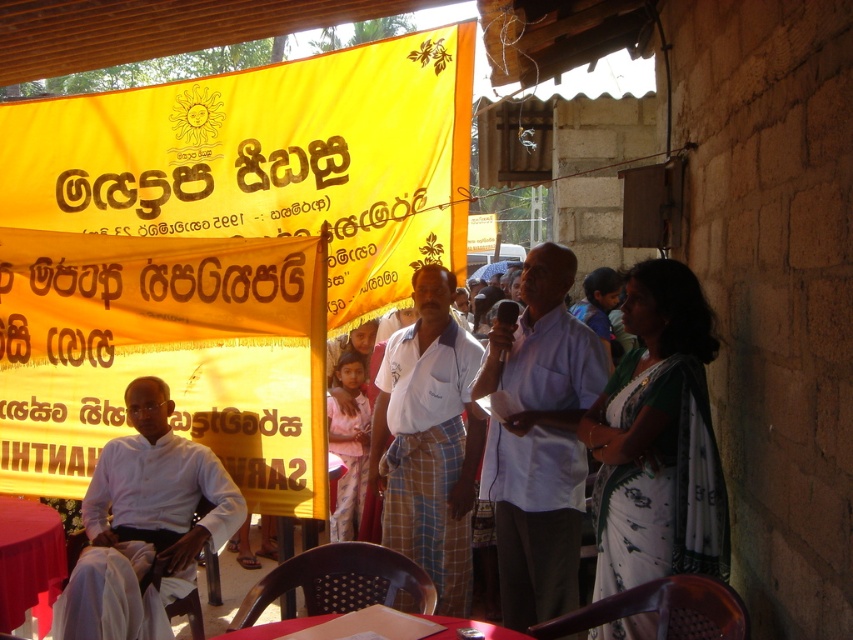
You are attending an outdoor event and notice the yellow fabric banner at upper left and the smooth red table at lower left. Which object is positioned higher in the scene?

The yellow fabric banner at upper left is positioned higher than the smooth red table at lower left.

From the picture: Based on the scene described, can you determine if the white woven shirt at center is wider than the smooth red table at lower left?

The white woven shirt at center might be wider than smooth red table at lower left according to the description.

You are organizing an event and need to decide where to place a new table. The yellow fabric banner at upper left and the smooth red table at lower left are already present. Which object occupies more horizontal space in the image?

The yellow fabric banner at upper left occupies more horizontal space than the smooth red table at lower left because its width is larger.